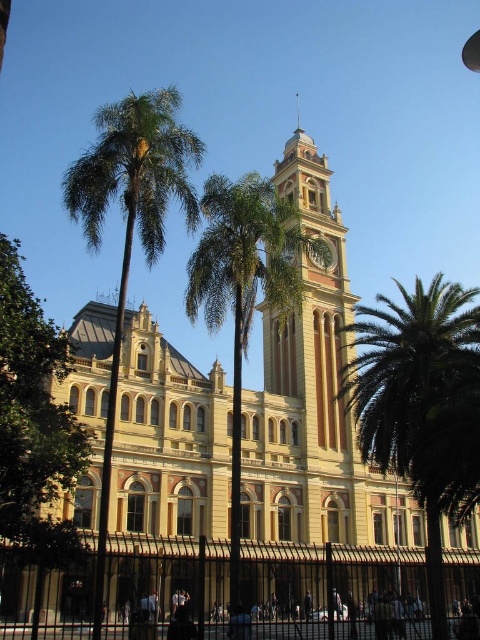
You are standing in front of the historic building and want to take a photo of both the green leafy palm at right and the green leafy palm at center. Which palm should you position closer to the camera to include both in the frame without cropping?

You should position the green leafy palm at right closer to the camera because it is shorter than the green leafy palm at center, allowing both to fit in the frame without cropping.

You are standing in front of the historic building and notice two green leafy trees. The green leafy tree at left and the green leafy palm at center. Which one is closer to the ground?

The green leafy tree at left is closer to the ground since it is positioned below the green leafy palm at center.

You are standing in front of the historic building and want to take a photo that includes both the green leafy palm at right and the green leafy palm at center. Which palm should you position closer to the left side of your camera frame to include both?

The green leafy palm at center should be positioned closer to the left side of your camera frame because the green leafy palm at right is to its right side, so moving the center palm left would allow both to fit.